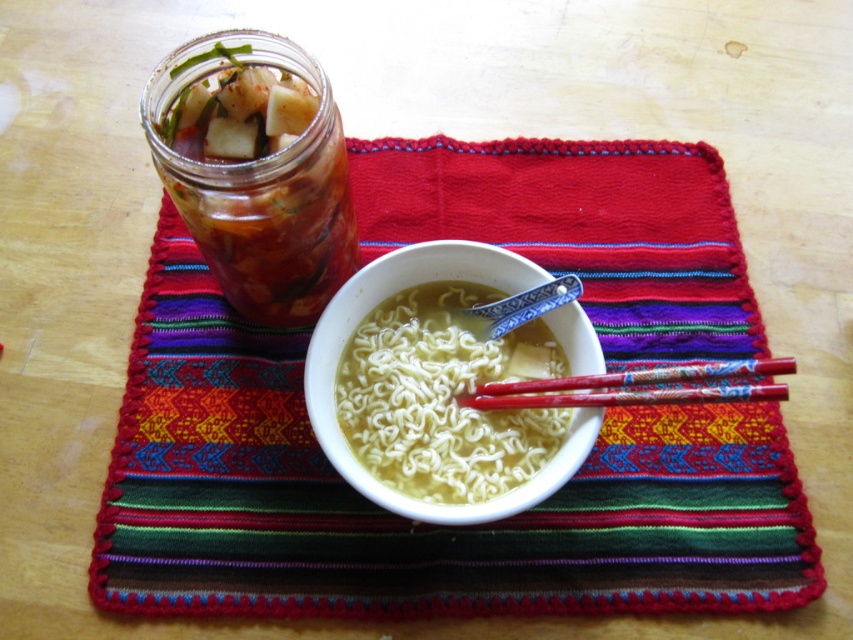
Can you confirm if multicolored woven placemat at center is positioned to the left of red lacquered chopsticks at center?

Yes, multicolored woven placemat at center is to the left of red lacquered chopsticks at center.

Between multicolored woven placemat at center and red lacquered chopsticks at center, which one appears on the right side from the viewer's perspective?

Positioned to the right is red lacquered chopsticks at center.

Which is behind, point (239, 413) or point (573, 388)?

The point (239, 413) is behind.

Image resolution: width=853 pixels, height=640 pixels. Identify the location of multicolored woven placemat at center. (405, 518).

Who is more distant from viewer, (637,493) or (271,68)?

The point (637,493) is behind.

Can you confirm if multicolored woven placemat at center is positioned to the left of translucent glass jar at upper left?

In fact, multicolored woven placemat at center is to the right of translucent glass jar at upper left.

Image resolution: width=853 pixels, height=640 pixels. Identify the location of multicolored woven placemat at center. (405, 518).

Image resolution: width=853 pixels, height=640 pixels. What are the coordinates of `multicolored woven placemat at center` in the screenshot? It's located at (405, 518).

Which is above, translucent glass jar at upper left or red lacquered chopsticks at center?

translucent glass jar at upper left

Is translucent glass jar at upper left wider than red lacquered chopsticks at center?

Incorrect, translucent glass jar at upper left's width does not surpass red lacquered chopsticks at center's.

Identify the location of translucent glass jar at upper left. This screenshot has height=640, width=853. (254, 170).